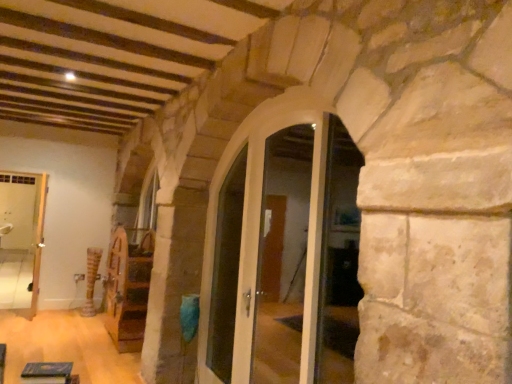
The image size is (512, 384). Identify the location of blank space situated above white glossy door at left (from a real-world perspective). (27, 171).